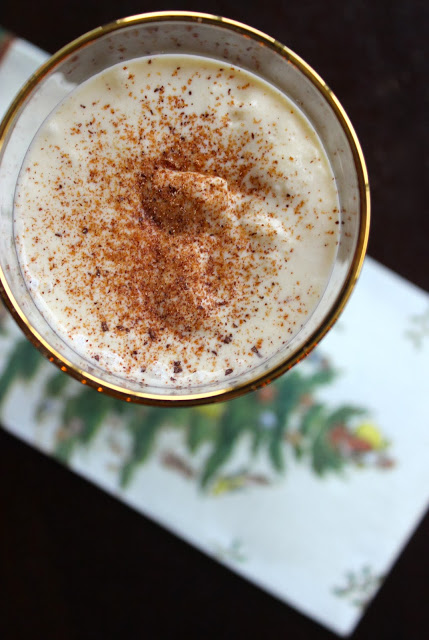
This screenshot has width=429, height=640. What are the coordinates of `shade` in the screenshot? It's located at (312, 80).